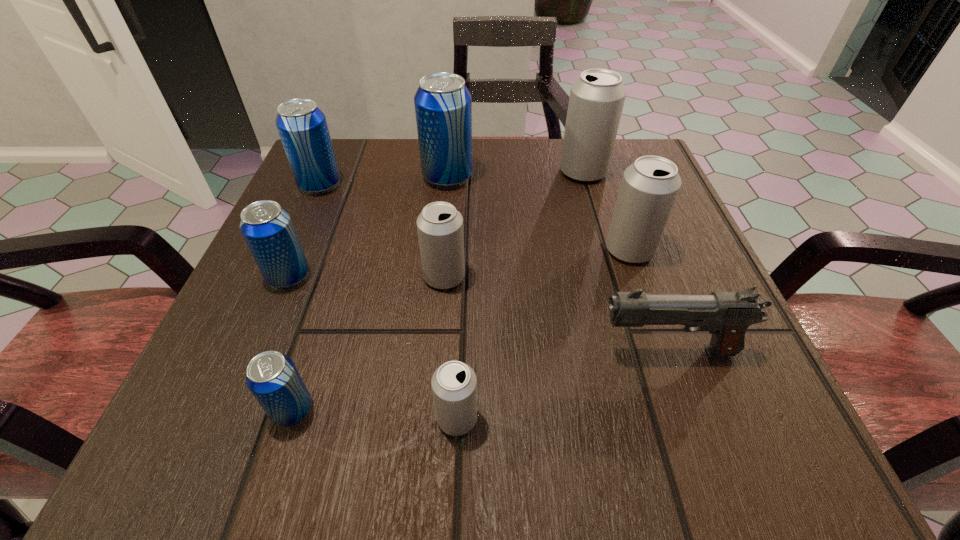
At what (x,y) coordinates should I click in order to perform the action: click on free location at the far left corner. Please return your answer as a coordinate pair (x, y). This screenshot has height=540, width=960. Looking at the image, I should click on (332, 139).

Where is `free space that is in between the farthest white beer can and the biggest blue beer can`? free space that is in between the farthest white beer can and the biggest blue beer can is located at coordinates (516, 174).

This screenshot has width=960, height=540. What are the coordinates of `unoccupied position between the third smallest white beer can and the third biggest white beer can` in the screenshot? It's located at (537, 263).

Image resolution: width=960 pixels, height=540 pixels. In order to click on free space that is in between the second smallest white beer can and the second biggest blue beer can in this screenshot , I will do pyautogui.click(x=382, y=231).

The width and height of the screenshot is (960, 540). Find the location of `empty location between the smallest white beer can and the third farthest blue beer can`. empty location between the smallest white beer can and the third farthest blue beer can is located at coordinates (372, 347).

Find the location of a particular element. This screenshot has width=960, height=540. free spot between the third farthest blue beer can and the rightmost blue beer can is located at coordinates (368, 227).

Image resolution: width=960 pixels, height=540 pixels. What are the coordinates of `unoccupied area between the third biggest white beer can and the third nearest object` in the screenshot? It's located at (556, 314).

At what (x,y) coordinates should I click in order to perform the action: click on free point between the third biggest blue beer can and the nearest blue beer can. Please return your answer as a coordinate pair (x, y). Looking at the image, I should click on (291, 343).

This screenshot has width=960, height=540. I want to click on vacant area that lies between the smallest white beer can and the third smallest white beer can, so click(x=543, y=334).

Identify the location of free space that is in between the smallest white beer can and the third biggest blue beer can. (372, 347).